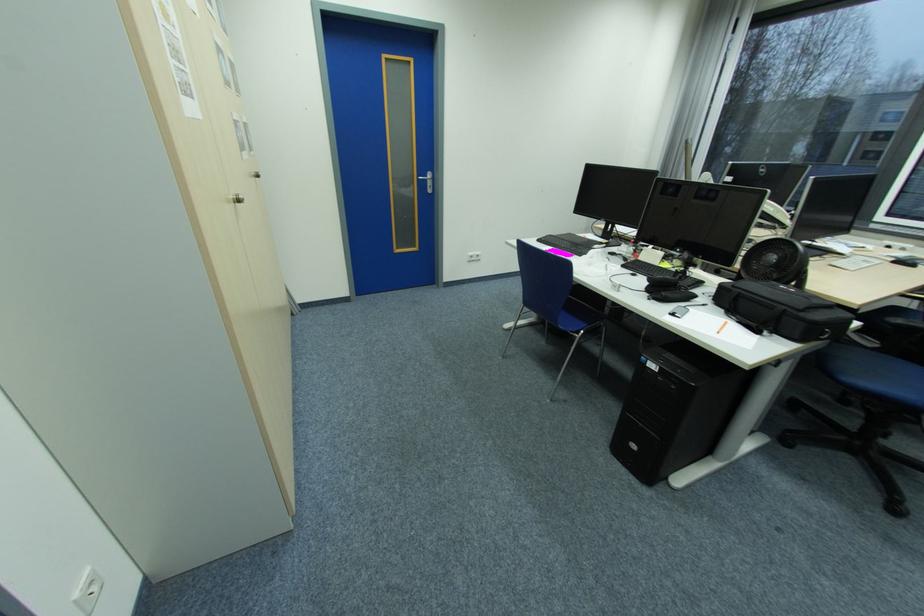
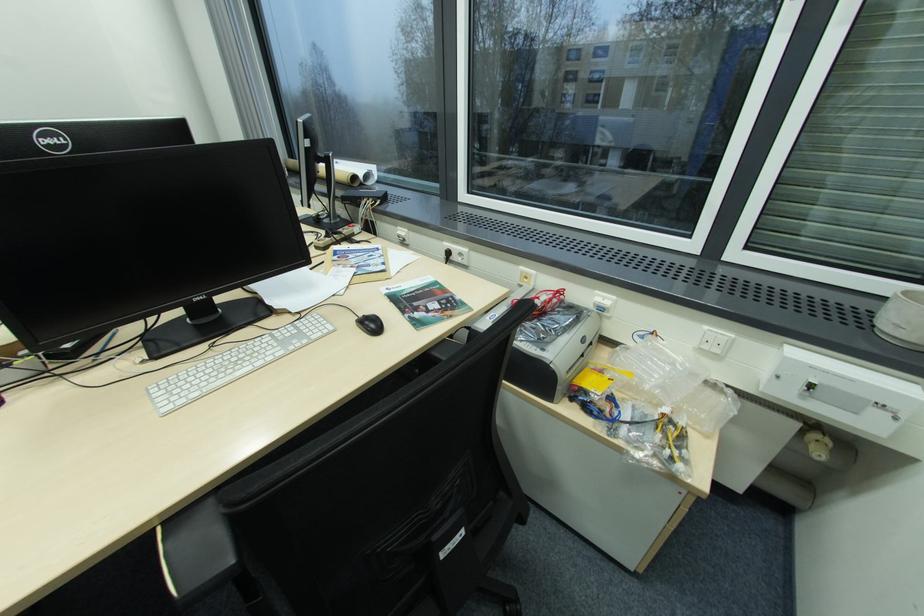
Where in the second image is the point corresponding to (852,269) from the first image?

(172, 403)